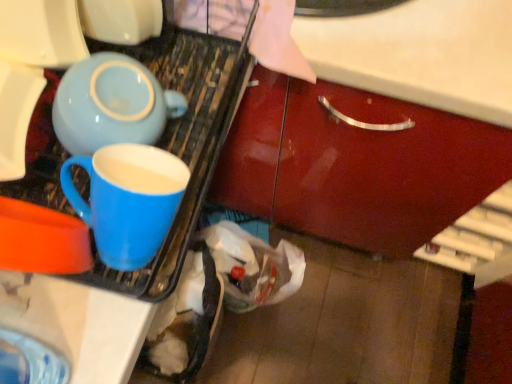
Question: Considering the relative sizes of matte blue mug at left and matte ceramic mug at left in the image provided, is matte blue mug at left taller than matte ceramic mug at left?

Choices:
 (A) no
 (B) yes

Answer: (B)

Question: Does matte blue mug at left have a larger size compared to matte ceramic mug at left?

Choices:
 (A) yes
 (B) no

Answer: (A)

Question: Is matte ceramic mug at left surrounded by matte blue mug at left?

Choices:
 (A) no
 (B) yes

Answer: (B)

Question: Is matte blue mug at left thinner than matte ceramic mug at left?

Choices:
 (A) yes
 (B) no

Answer: (B)

Question: Considering the relative sizes of matte blue mug at left and matte ceramic mug at left in the image provided, is matte blue mug at left smaller than matte ceramic mug at left?

Choices:
 (A) yes
 (B) no

Answer: (B)

Question: From the image's perspective, would you say matte blue mug at left is shown under matte ceramic mug at left?

Choices:
 (A) no
 (B) yes

Answer: (A)

Question: Can you confirm if matte ceramic mug at left is wider than matte blue mug at left?

Choices:
 (A) yes
 (B) no

Answer: (B)

Question: Is matte ceramic mug at left facing towards matte blue mug at left?

Choices:
 (A) yes
 (B) no

Answer: (A)

Question: Is matte ceramic mug at left smaller than matte blue mug at left?

Choices:
 (A) yes
 (B) no

Answer: (A)

Question: From the image's perspective, is matte ceramic mug at left on matte blue mug at left?

Choices:
 (A) no
 (B) yes

Answer: (A)

Question: Is the position of matte ceramic mug at left less distant than that of matte blue mug at left?

Choices:
 (A) yes
 (B) no

Answer: (A)

Question: Can you confirm if matte ceramic mug at left is thinner than matte blue mug at left?

Choices:
 (A) no
 (B) yes

Answer: (B)

Question: In terms of height, does matte blue mug at left look taller or shorter compared to matte ceramic mug at left?

Choices:
 (A) tall
 (B) short

Answer: (A)